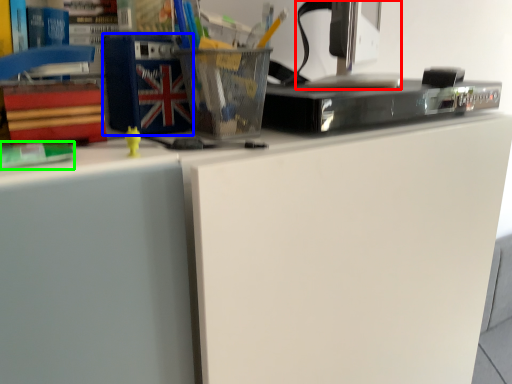
Question: Based on their relative distances, which object is farther from desktop computer (highlighted by a red box)? Choose from paperback book (highlighted by a blue box) and book (highlighted by a green box).

Choices:
 (A) paperback book
 (B) book

Answer: (B)